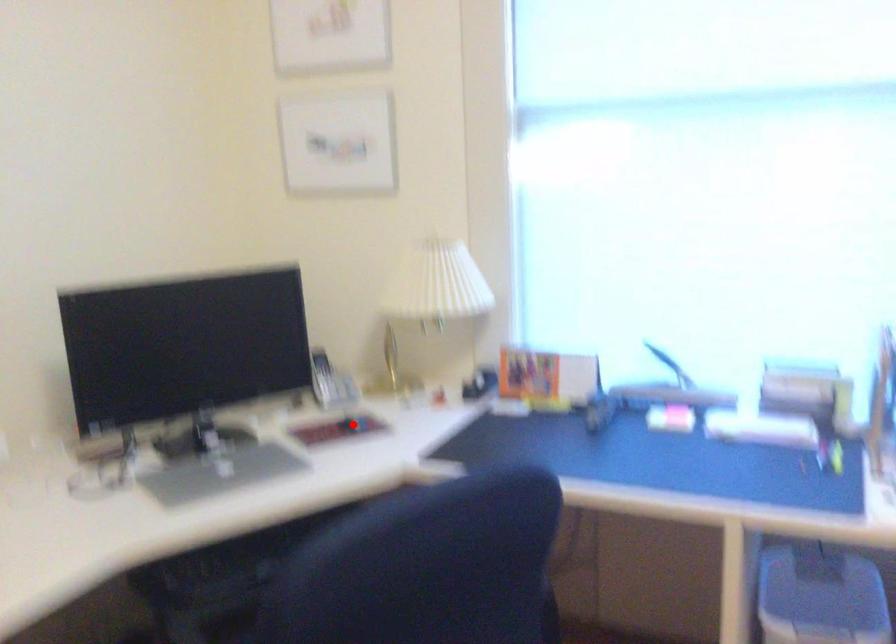
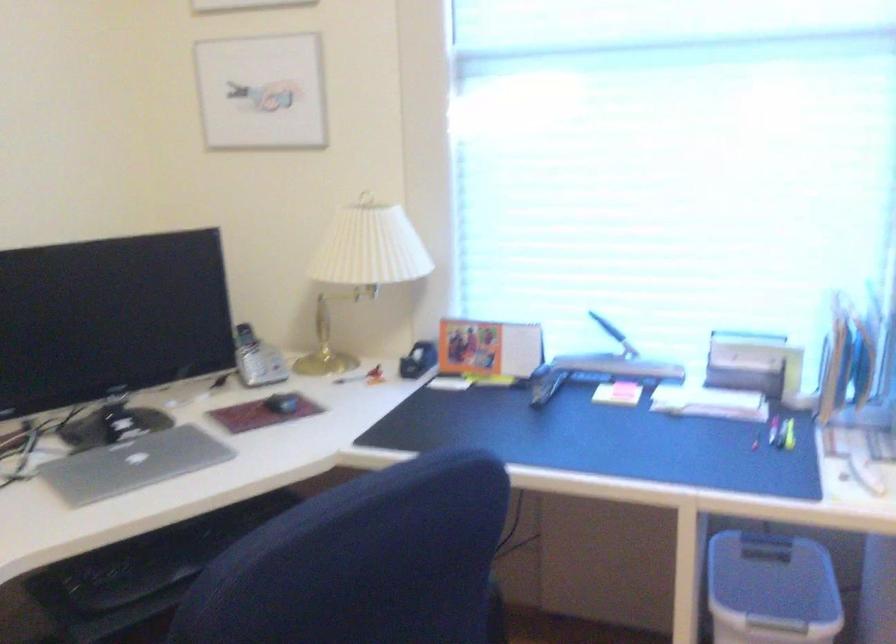
The point at the highlighted location is marked in the first image. Where is the corresponding point in the second image?

(281, 402)